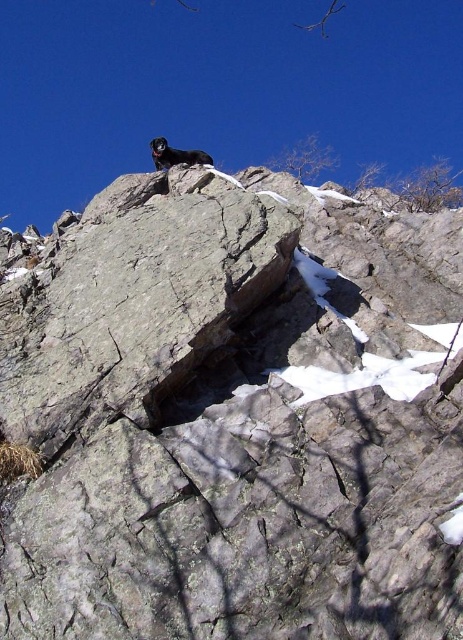
From the picture: Measure the distance from gray rough rock at upper center to black fur dog at upper center.

23.46 meters

In order to click on gray rough rock at upper center in this screenshot , I will do coord(231,416).